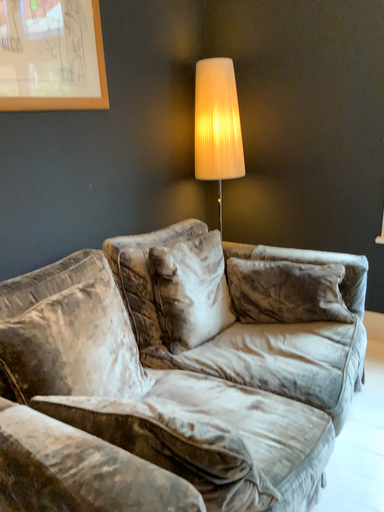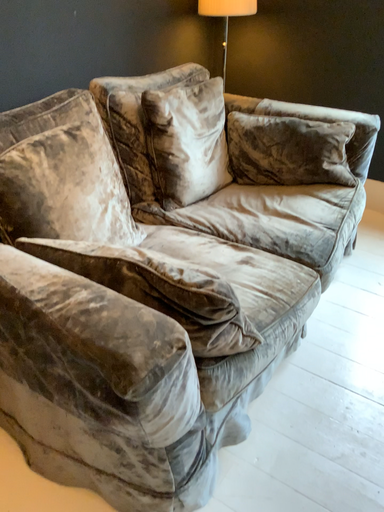
Question: How did the camera likely rotate when shooting the video?

Choices:
 (A) rotated downward
 (B) rotated upward

Answer: (A)